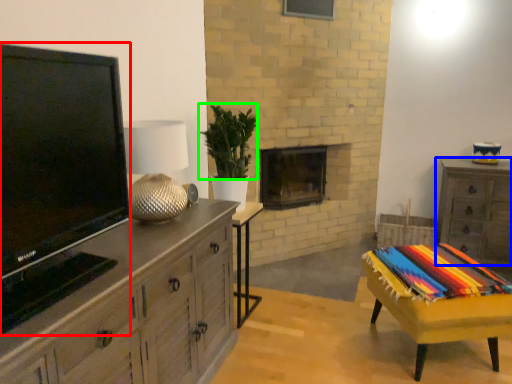
Question: Which is nearer to the television (highlighted by a red box)? chest of drawers (highlighted by a blue box) or plant (highlighted by a green box).

Choices:
 (A) chest of drawers
 (B) plant

Answer: (B)